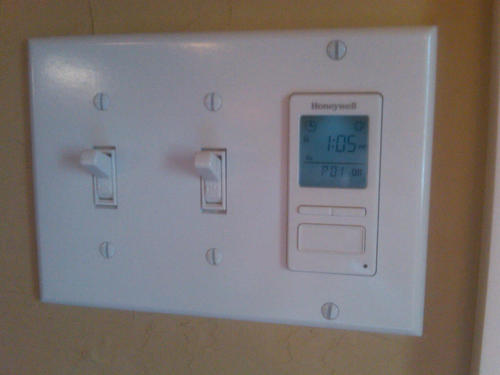
This screenshot has width=500, height=375. I want to click on light switch, so click(204, 161).